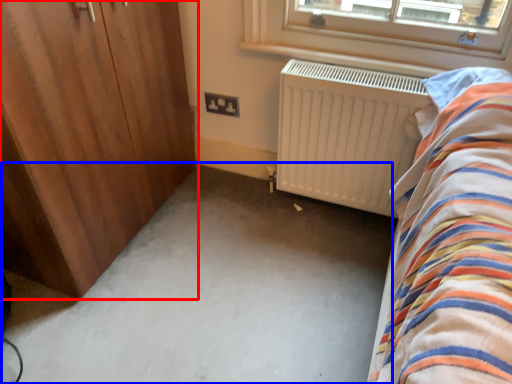
Question: Which of the following is the farthest to the observer, door (highlighted by a red box) or plain (highlighted by a blue box)?

Choices:
 (A) door
 (B) plain

Answer: (B)